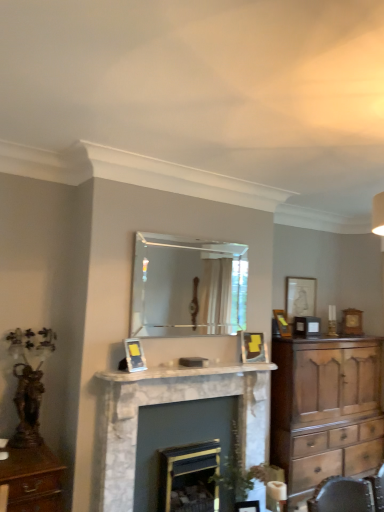
I want to click on vacant space underneath clear glass mirror at center (from a real-world perspective), so click(181, 364).